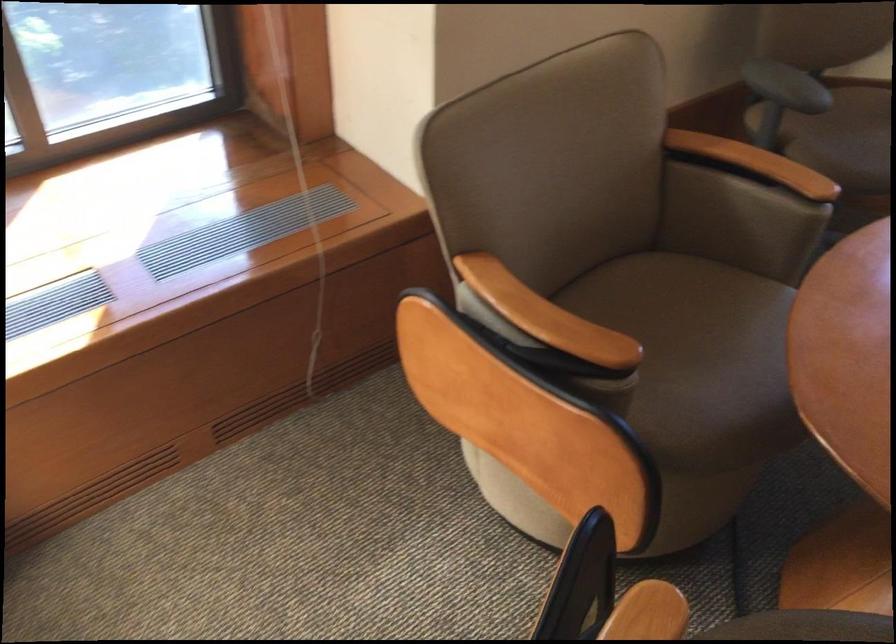
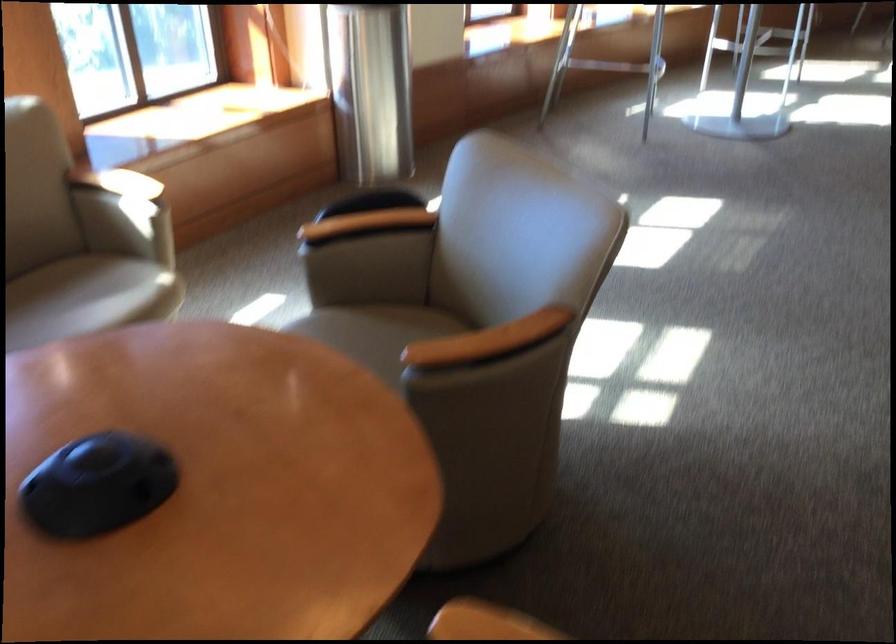
First-person continuous shooting, in which direction is the camera rotating?

The camera rotated toward right-down.